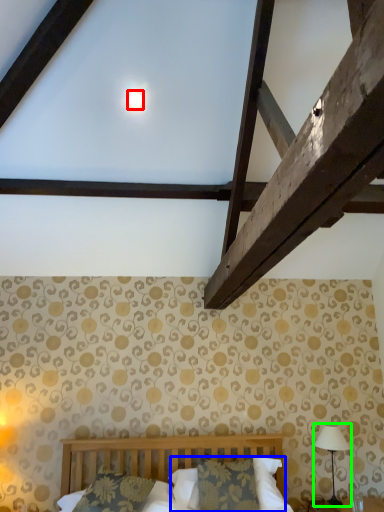
Question: Which is nearer to the moonlight (highlighted by a red box)? pillow (highlighted by a blue box) or table lamp (highlighted by a green box).

Choices:
 (A) pillow
 (B) table lamp

Answer: (A)